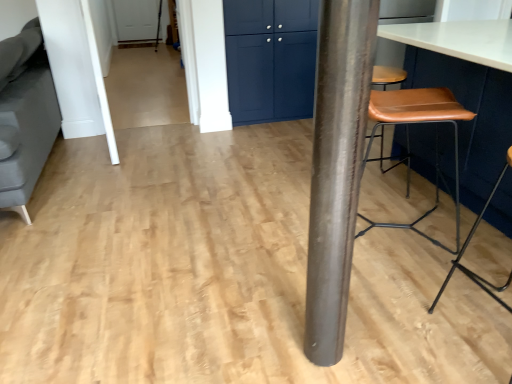
You are a GUI agent. You are given a task and a screenshot of the screen. Output one action in this format:
    pyautogui.click(x=<x>, y=<y>)
    Task: Click on the free region under brown leather stool at right (from a real-world perspective)
    The width and height of the screenshot is (512, 384).
    Given the screenshot: What is the action you would take?
    pyautogui.click(x=390, y=226)